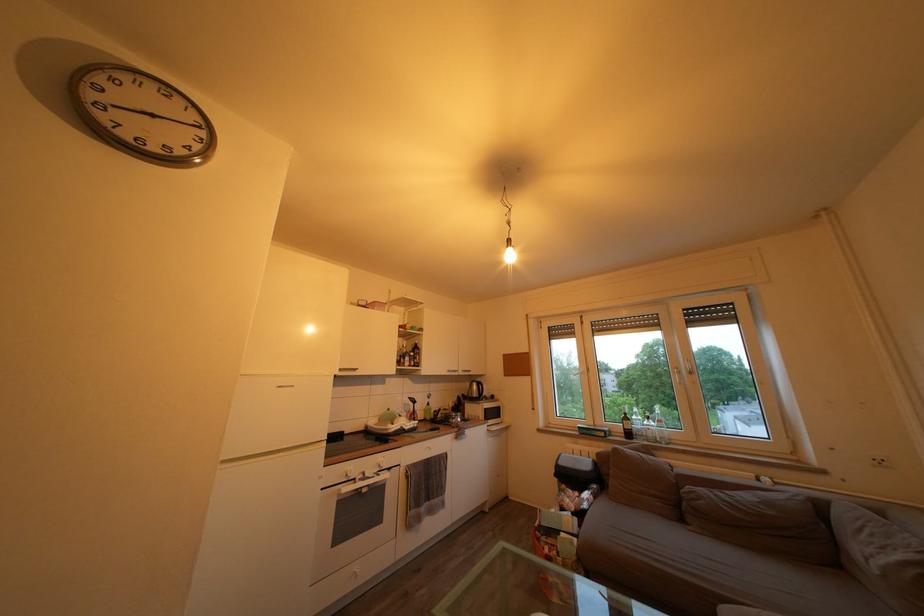
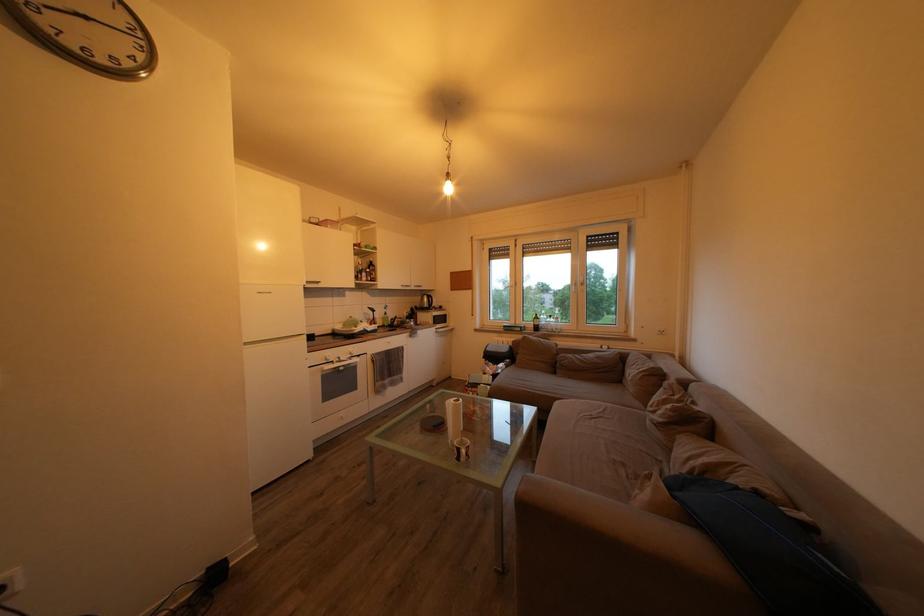
Question: What movement of the cameraman would produce the second image?

Choices:
 (A) Left
 (B) Right
 (C) Forward
 (D) Backward

Answer: (D)